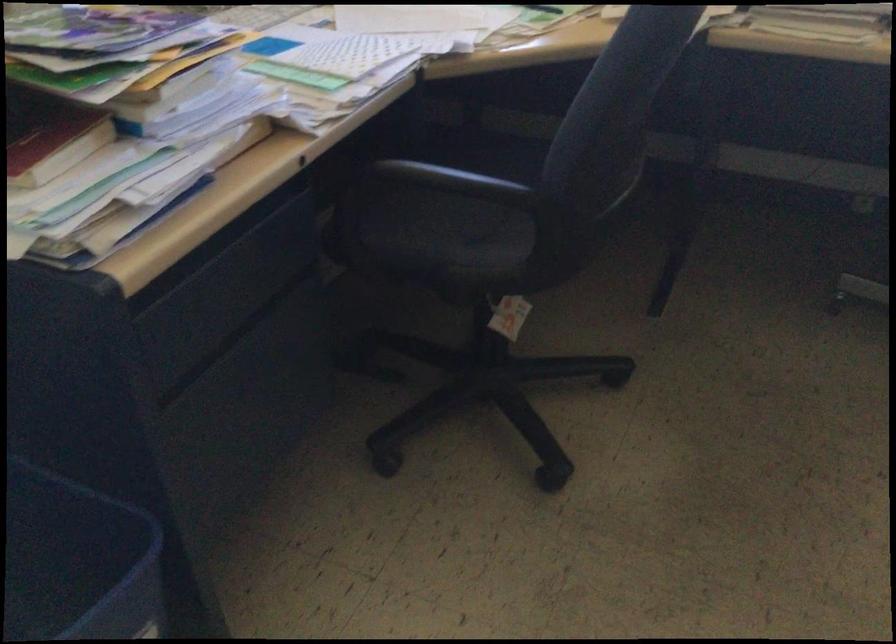
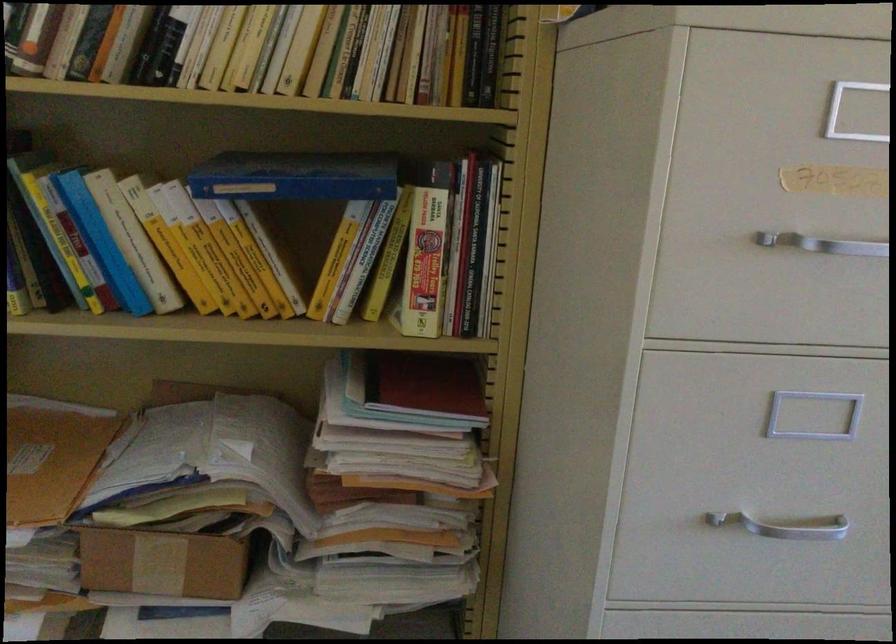
Question: Based on the continuous images, in which direction is the camera rotating? Reply with the corresponding letter.

Choices:
 (A) Left
 (B) Right
 (C) Up
 (D) Down

Answer: (A)